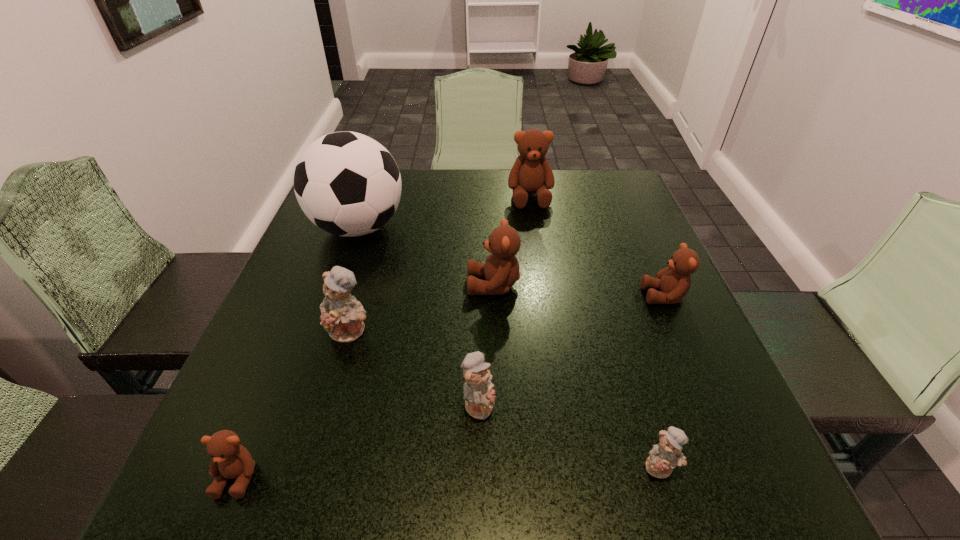
Identify the location of object that is at the near right corner. (665, 456).

I want to click on vacant space at the far edge of the desktop, so click(x=404, y=173).

At what (x,y) coordinates should I click in order to perform the action: click on vacant space at the near edge of the desktop. Please return your answer as a coordinate pair (x, y). Looking at the image, I should click on (410, 462).

Find the location of a particular element. This screenshot has width=960, height=540. free region at the right edge of the desktop is located at coordinates (628, 350).

Identify the location of free region at the near left corner of the desktop. (287, 499).

This screenshot has height=540, width=960. What are the coordinates of `vacant region at the far right corner of the desktop` in the screenshot? It's located at pos(615,195).

In the image, there is a desktop. Where is `vacant space at the near right corner`? vacant space at the near right corner is located at coordinates (771, 479).

You are a GUI agent. You are given a task and a screenshot of the screen. Output one action in this format:
    pyautogui.click(x=<x>, y=<y>)
    Task: Click on the unoccupied position between the leftmost teddy bear and the soccer ball
    This screenshot has height=540, width=960.
    Given the screenshot: What is the action you would take?
    pyautogui.click(x=299, y=352)

I want to click on free space between the second farthest blue teddy bear and the smallest blue teddy bear, so click(569, 435).

The image size is (960, 540). In order to click on vacant space in between the sixth teddy bear from left to right and the fourth nearest teddy bear in this screenshot , I will do `click(505, 399)`.